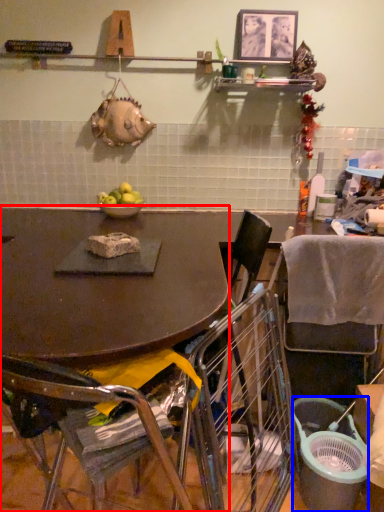
Question: Which object appears closest to the camera in this image, desk (highlighted by a red box) or trash bin/can (highlighted by a blue box)?

Choices:
 (A) desk
 (B) trash bin/can

Answer: (A)